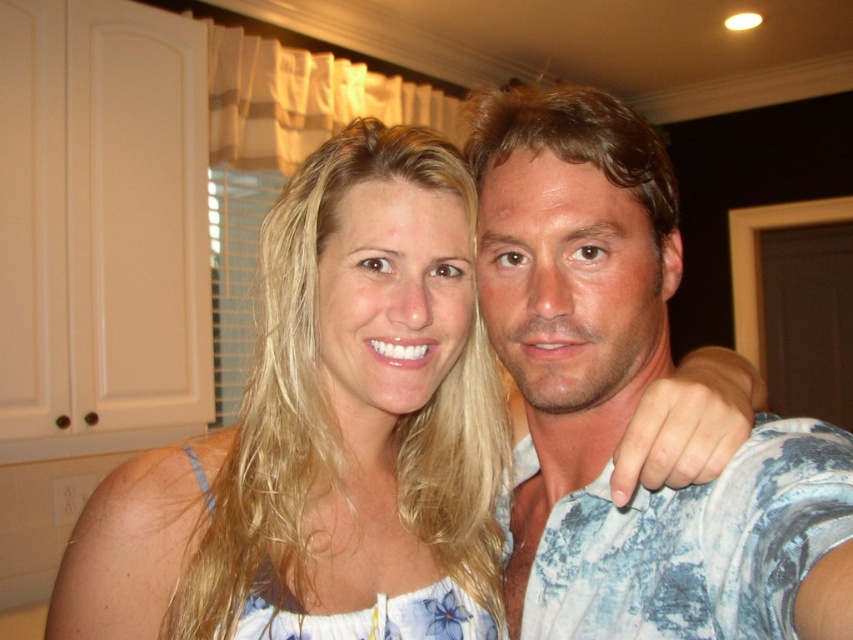
Which of these two, blonde hair at center or blue tie-dye shirt at right, stands shorter?

With less height is blonde hair at center.

Is blonde hair at center taller than blue tie-dye shirt at right?

No, blonde hair at center is not taller than blue tie-dye shirt at right.

Identify the location of blonde hair at center. (323, 426).